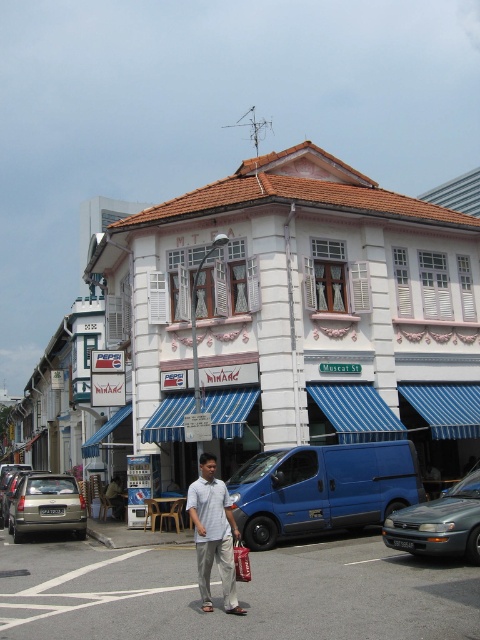
Image resolution: width=480 pixels, height=640 pixels. I want to click on metallic gray sedan at center, so click(440, 522).

Is the position of metallic gray sedan at center more distant than that of light gray cotton shirt at center?

Yes, metallic gray sedan at center is behind light gray cotton shirt at center.

At what (x,y) coordinates should I click in order to perform the action: click on metallic gray sedan at center. Please return your answer as a coordinate pair (x, y). This screenshot has height=640, width=480. Looking at the image, I should click on (440, 522).

You are a GUI agent. You are given a task and a screenshot of the screen. Output one action in this format:
    pyautogui.click(x=<x>, y=<y>)
    Task: Click on the metallic gray sedan at center
    The image size is (480, 640).
    Given the screenshot: What is the action you would take?
    pyautogui.click(x=440, y=522)

The height and width of the screenshot is (640, 480). I want to click on blue metallic van at center, so click(322, 488).

Is point (254, 502) less distant than point (17, 474)?

Yes, it is.

Find the location of `blue metallic van at center`. blue metallic van at center is located at coordinates (322, 488).

Which is in front, point (6, 522) or point (240, 556)?

Point (240, 556) is more forward.

Can you confirm if silver metallic sedan at center-left is positioned below red fabric shopping bag at center?

Yes.

Is point (9, 486) positioned in front of point (240, 540)?

No, (9, 486) is further to viewer.

The image size is (480, 640). What are the coordinates of `silver metallic sedan at center-left` in the screenshot? It's located at (13, 492).